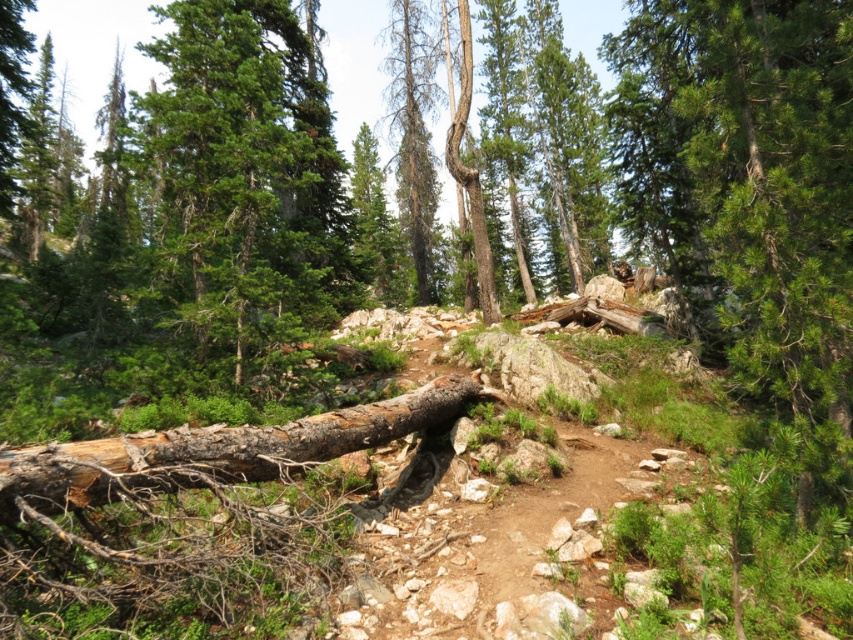
Can you confirm if grayish-brown bark log at center is positioned above dead wood trunk at center?

No.

From the picture: Which of these two, grayish-brown bark log at center or dead wood trunk at center, stands shorter?

grayish-brown bark log at center

Who is more forward, (x=408, y=404) or (x=396, y=60)?

Point (x=408, y=404) is more forward.

You are a GUI agent. You are given a task and a screenshot of the screen. Output one action in this format:
    pyautogui.click(x=<x>, y=<y>)
    Task: Click on the grayish-brown bark log at center
    The height and width of the screenshot is (640, 853).
    Given the screenshot: What is the action you would take?
    pyautogui.click(x=218, y=449)

Based on the photo, can you confirm if green matte tree at upper left is wider than grayish-brown bark log at center?

Yes, green matte tree at upper left is wider than grayish-brown bark log at center.

Find the location of a particular element. The width and height of the screenshot is (853, 640). green matte tree at upper left is located at coordinates (245, 179).

I want to click on green matte tree at upper left, so click(x=245, y=179).

Is green matte tree at upper left wider than dead wood trunk at center?

No, green matte tree at upper left is not wider than dead wood trunk at center.

Is point (207, 116) closer to camera compared to point (410, 216)?

That is True.

Who is more forward, (310, 285) or (386, 61)?

Point (310, 285) is more forward.

Where is `green matte tree at upper left`? green matte tree at upper left is located at coordinates (245, 179).